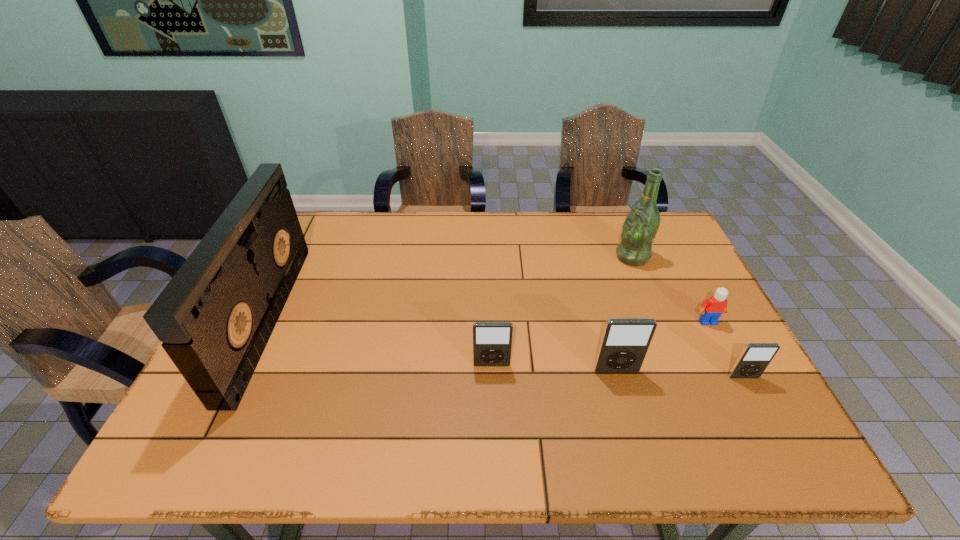
Locate an element on the screen. The height and width of the screenshot is (540, 960). vacant space located 0.060m on the front-facing side of the second farthest iPod is located at coordinates (623, 395).

In order to click on vacant area located on the surface of the beer bottle in this screenshot , I will do `click(533, 257)`.

You are a GUI agent. You are given a task and a screenshot of the screen. Output one action in this format:
    pyautogui.click(x=<x>, y=<y>)
    Task: Click on the free region located 0.310m on the surface of the beer bottle
    The image size is (960, 540).
    Given the screenshot: What is the action you would take?
    pos(517,257)

Locate an element on the screen. vacant space located on the surface of the beer bottle is located at coordinates (530, 257).

Where is `vacant space located 0.050m on the face of the Lego`? The width and height of the screenshot is (960, 540). vacant space located 0.050m on the face of the Lego is located at coordinates (717, 340).

The image size is (960, 540). I want to click on free point located on the front side of the videotape, so click(x=316, y=319).

Identify the location of beer bottle present at the far edge. (640, 227).

The width and height of the screenshot is (960, 540). In order to click on videotape located at the far edge in this screenshot , I will do click(215, 317).

I want to click on object that is positioned at the near edge, so click(x=215, y=317).

What are the coordinates of `object that is at the left edge` in the screenshot? It's located at [215, 317].